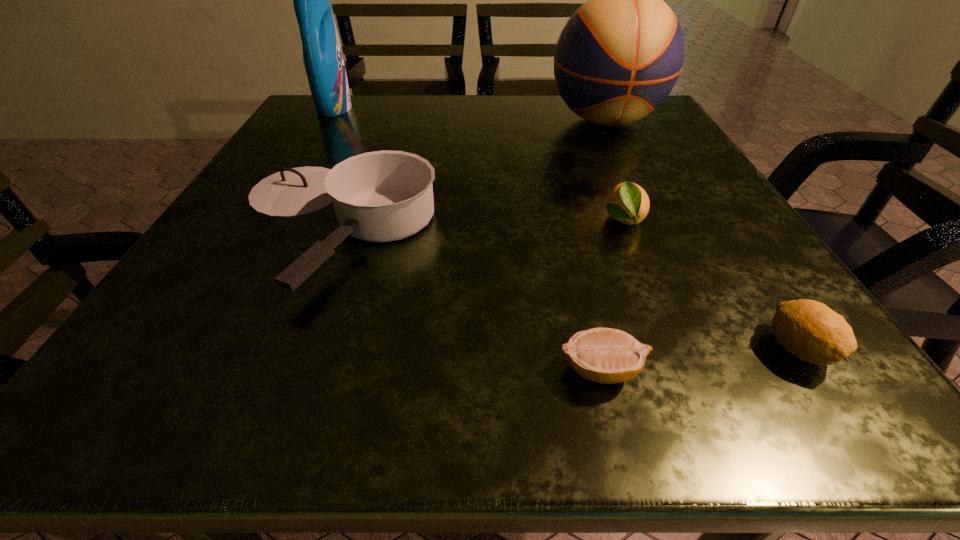
This screenshot has width=960, height=540. What are the coordinates of `detergent` in the screenshot? It's located at (322, 55).

You are a GUI agent. You are given a task and a screenshot of the screen. Output one action in this format:
    pyautogui.click(x=<x>, y=<y>)
    Task: Click on the basketball
    The image size is (960, 540).
    Given the screenshot: What is the action you would take?
    pyautogui.click(x=618, y=57)

You are a GUI agent. You are given a task and a screenshot of the screen. Output one action in this format:
    pyautogui.click(x=<x>, y=<y>)
    Task: Click on the saucepan
    The image size is (960, 540).
    Given the screenshot: What is the action you would take?
    tap(382, 196)

Find the location of a particular element. Image resolution: width=960 pixels, height=540 pixels. the farthest lemon is located at coordinates (629, 204).

Identify the location of the rightmost lemon. Image resolution: width=960 pixels, height=540 pixels. (810, 330).

Find the location of a particular element. This screenshot has width=960, height=540. the shortest object is located at coordinates (604, 355).

Locate an element on the screen. the shortest lemon is located at coordinates (604, 355).

Find the location of a particular element. vacant space located 0.280m on the front-facing side of the detergent is located at coordinates (467, 107).

In order to click on vacant position located on the patterned surface of the basketball in this screenshot , I will do `click(636, 186)`.

This screenshot has height=540, width=960. Find the location of `free space located 0.220m on the back of the saucepan`. free space located 0.220m on the back of the saucepan is located at coordinates (375, 120).